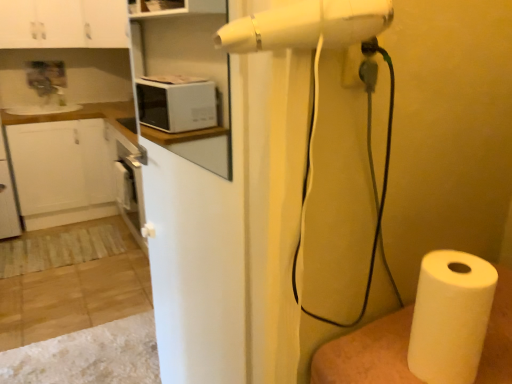
Where is `vacant space situated on the left part of white paper at lower right`? This screenshot has height=384, width=512. vacant space situated on the left part of white paper at lower right is located at coordinates (373, 353).